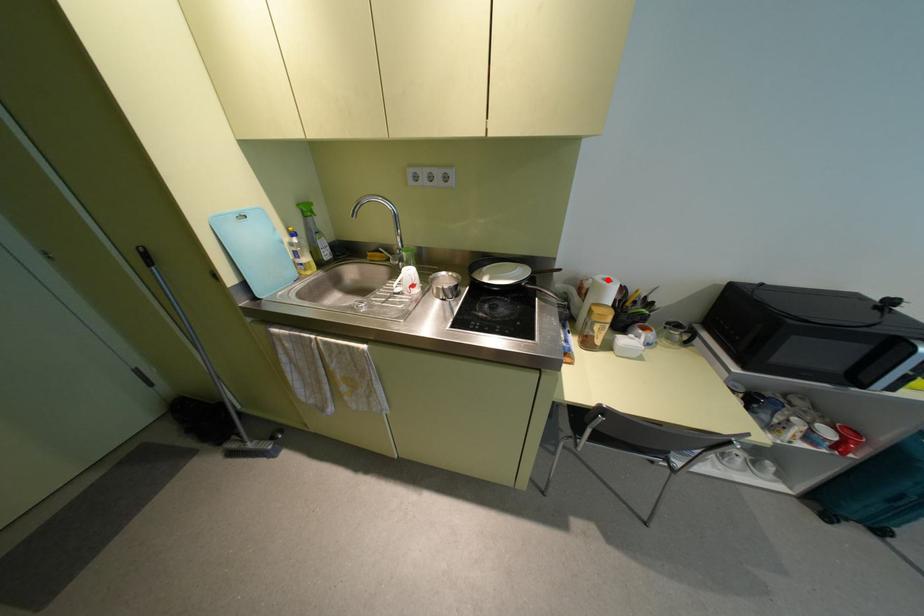
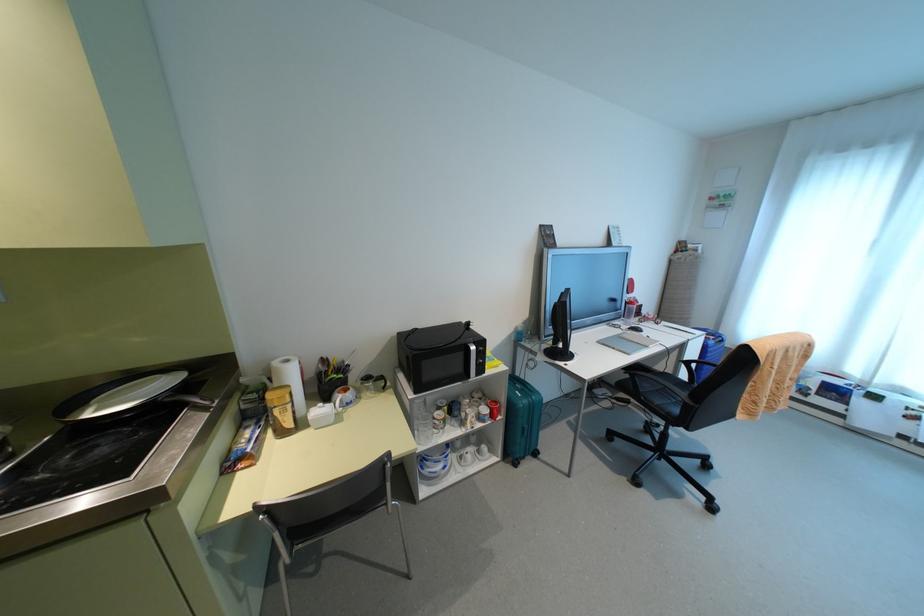
The point at the highlighted location is marked in the first image. Where is the corresponding point in the second image?

(286, 361)